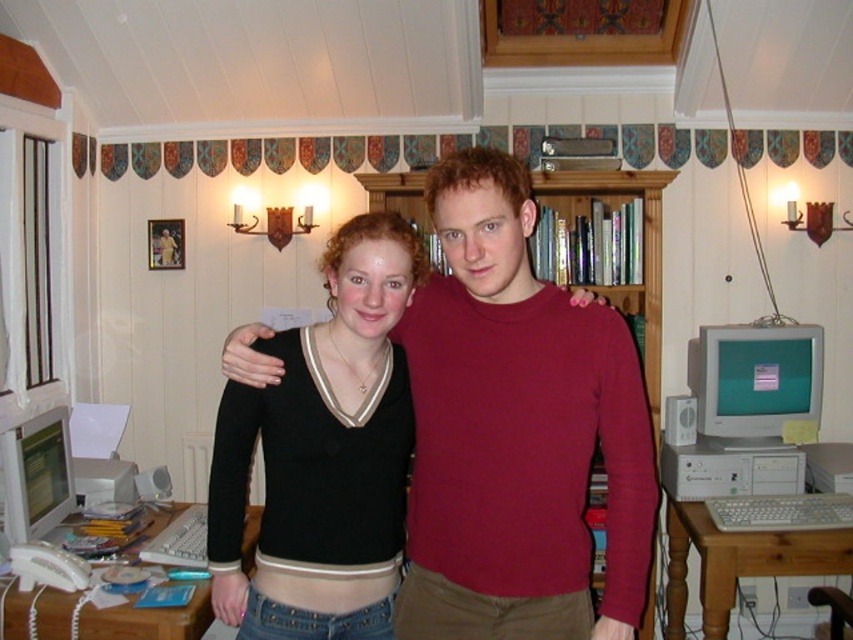
Question: Does matte white monitor at lower left come behind white plastic desktop computer at lower right?

Choices:
 (A) no
 (B) yes

Answer: (A)

Question: Which point is farther to the camera?

Choices:
 (A) (728, 424)
 (B) (721, 472)

Answer: (A)

Question: Which of these objects is positioned farthest from the black jersey at center?

Choices:
 (A) matte white monitor at lower left
 (B) matte silver monitor at right
 (C) white plastic desktop computer at lower right

Answer: (B)

Question: Does black jersey at center have a lesser width compared to white plastic desktop computer at lower right?

Choices:
 (A) yes
 (B) no

Answer: (B)

Question: In this image, where is matte silver monitor at right located relative to matte white monitor at lower left?

Choices:
 (A) right
 (B) left

Answer: (A)

Question: Among these points, which one is farthest from the camera?

Choices:
 (A) (643, 627)
 (B) (326, 605)

Answer: (A)